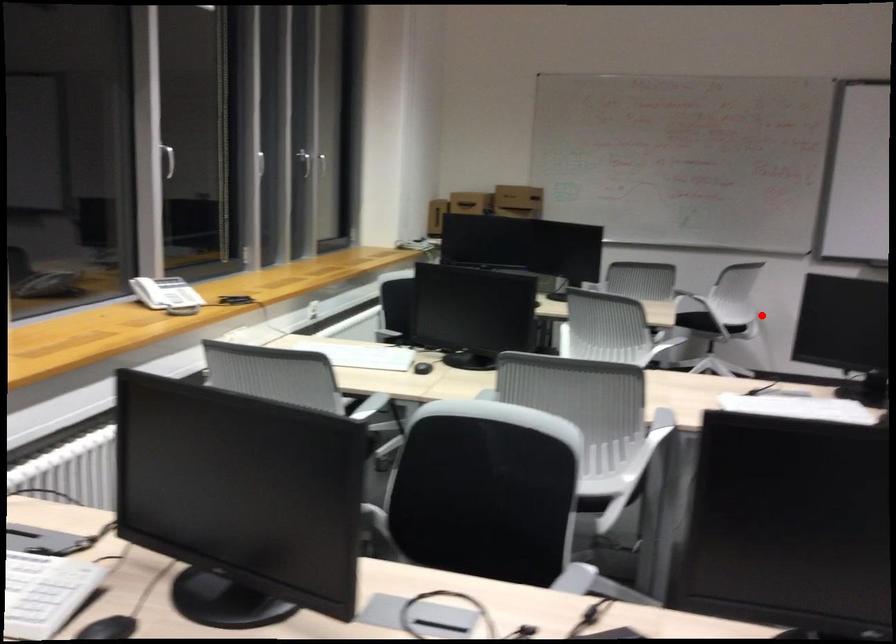
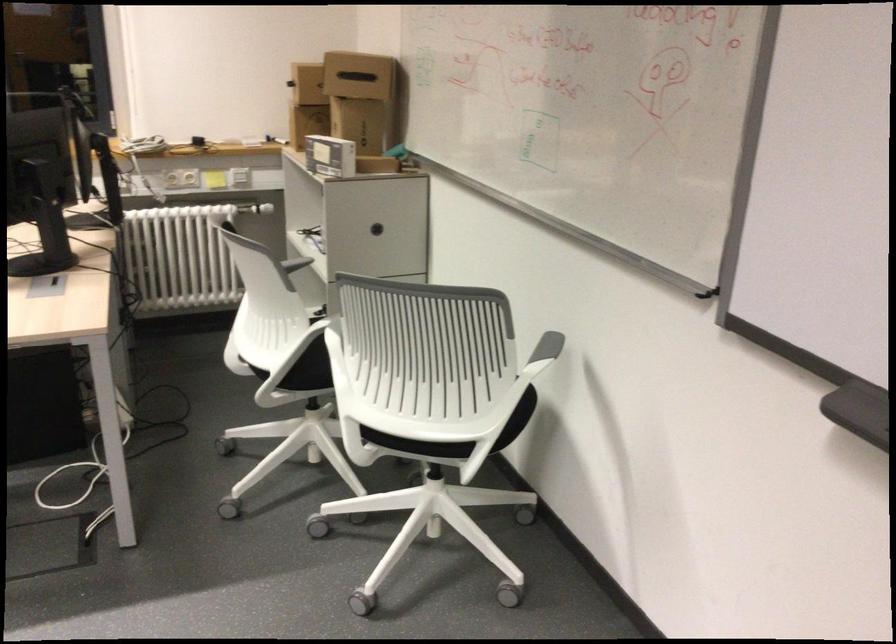
Question: I am providing you with two images of the same scene from different viewpoints. In image1, a red point is highlighted. Considering the same 3D point in image2, which of the following is correct?

Choices:
 (A) It is closer
 (B) It is farther

Answer: (A)